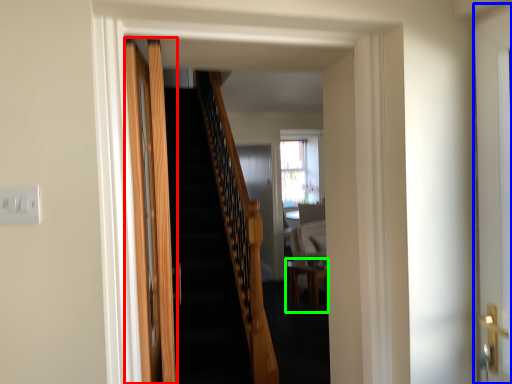
Question: Estimate the real-world distances between objects in this image. Which object is farther from door (highlighted by a red box), door (highlighted by a blue box) or table (highlighted by a green box)?

Choices:
 (A) door
 (B) table

Answer: (B)